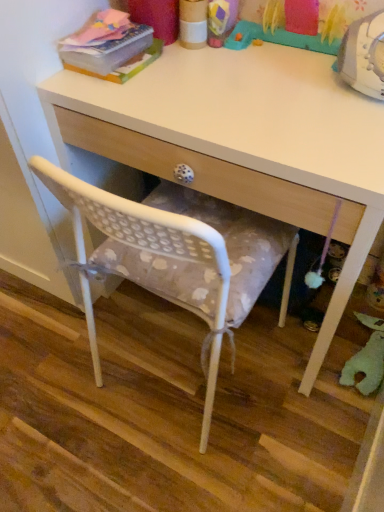
At what (x,y) coordinates should I click in order to perform the action: click on free point to the right of matte pink book at upper left. Please return your answer as a coordinate pair (x, y). Looking at the image, I should click on (194, 70).